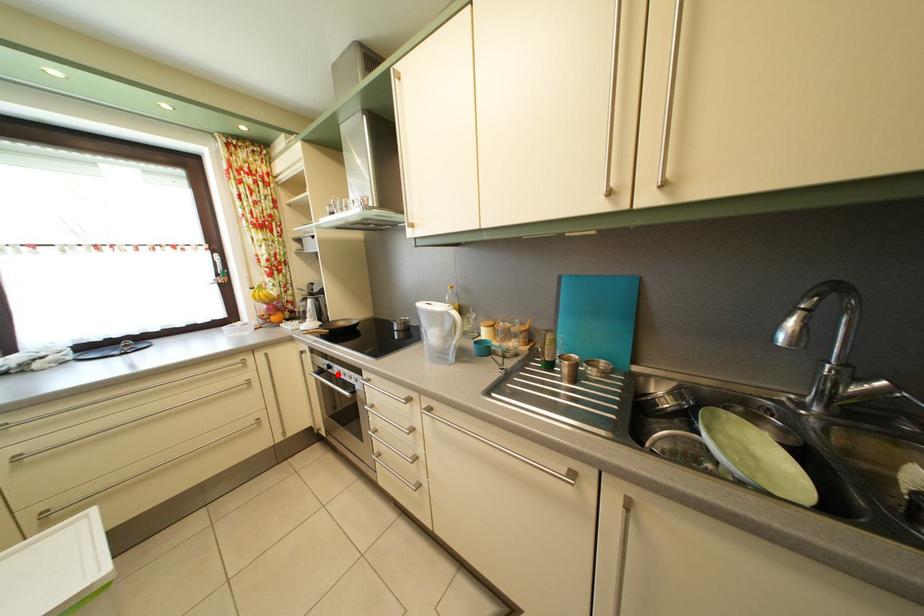
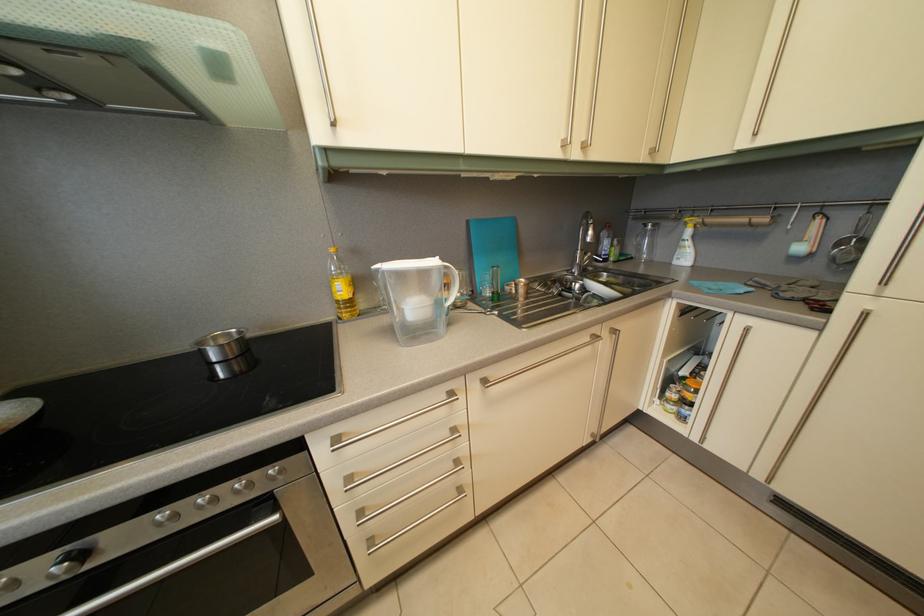
In the second image, find the point that corresponds to the highlighted location in the first image.

(92, 562)